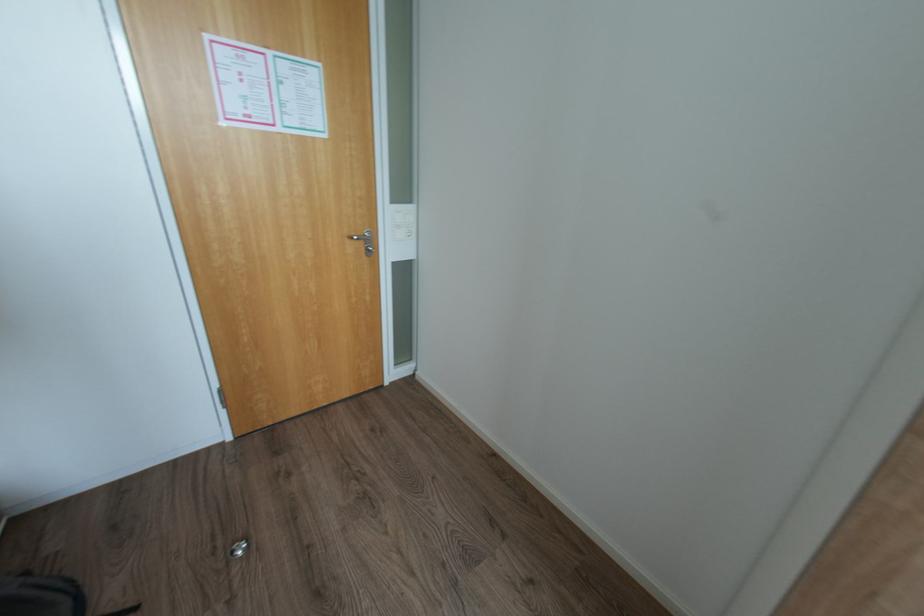
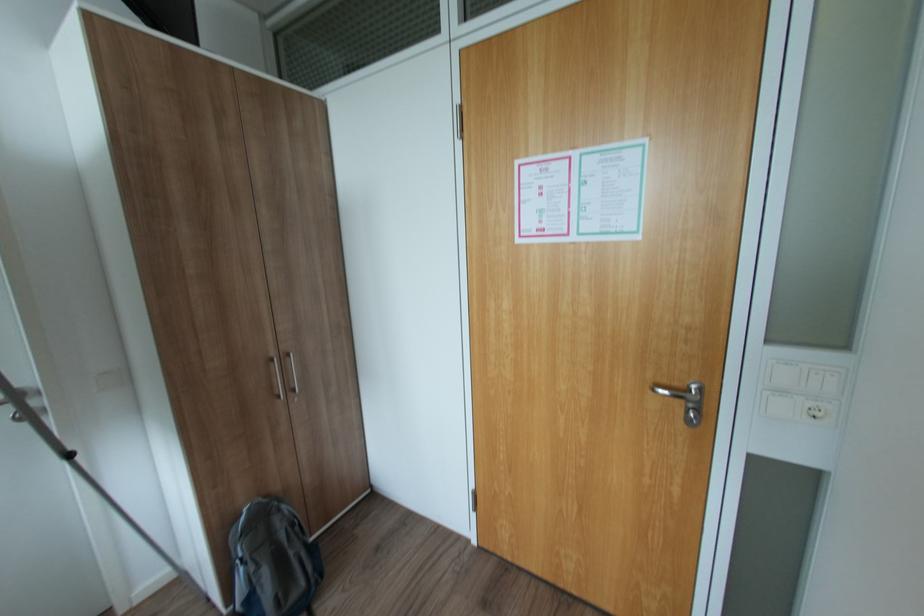
Locate, in the second image, the point that corresponds to [360,237] in the first image.

(664, 390)